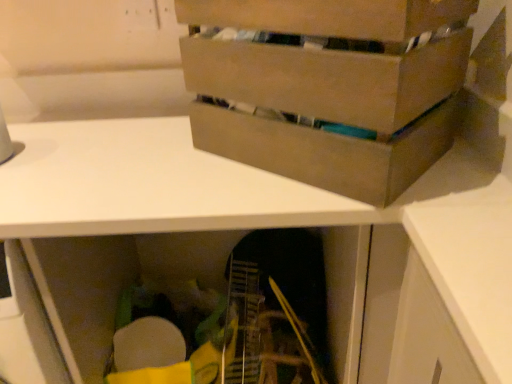
Identify the location of white matte desk at center. (251, 210).

Describe the element at coordinates (251, 210) in the screenshot. The image size is (512, 384). I see `white matte desk at center` at that location.

Describe the element at coordinates (328, 79) in the screenshot. I see `brown cardboard box at upper center` at that location.

Where is `brown cardboard box at upper center`? The image size is (512, 384). brown cardboard box at upper center is located at coordinates (328, 79).

This screenshot has height=384, width=512. Identify the location of white matte desk at center. (251, 210).

Is brown cardboard box at upper center to the left or to the right of white matte desk at center in the image?

From the image, it's evident that brown cardboard box at upper center is to the right of white matte desk at center.

Between brown cardboard box at upper center and white matte desk at center, which one is positioned in front?

brown cardboard box at upper center is closer to the camera.

Between point (429, 96) and point (236, 202), which one is positioned in front?

Point (429, 96)

From the image's perspective, which is below, brown cardboard box at upper center or white matte desk at center?

white matte desk at center is shown below in the image.

From the picture: From a real-world perspective, does brown cardboard box at upper center stand above white matte desk at center?

Yes.

Which object is thinner, brown cardboard box at upper center or white matte desk at center?

brown cardboard box at upper center is thinner.

Does brown cardboard box at upper center have a lesser height compared to white matte desk at center?

Correct, brown cardboard box at upper center is not as tall as white matte desk at center.

Is brown cardboard box at upper center bigger or smaller than white matte desk at center?

Clearly, brown cardboard box at upper center is smaller in size than white matte desk at center.

Which is correct: brown cardboard box at upper center is inside white matte desk at center, or outside of it?

brown cardboard box at upper center lies outside white matte desk at center.

Does brown cardboard box at upper center touch white matte desk at center?

There is a gap between brown cardboard box at upper center and white matte desk at center.

Based on the photo, is brown cardboard box at upper center facing away from white matte desk at center?

brown cardboard box at upper center does not have its back to white matte desk at center.

What's the angular difference between brown cardboard box at upper center and white matte desk at center's facing directions?

40.6 degrees.

Image resolution: width=512 pixels, height=384 pixels. Identify the location of desk that appears below the brown cardboard box at upper center (from the image's perspective). (251, 210).

Is white matte desk at center at the right side of brown cardboard box at upper center?

No, white matte desk at center is not to the right of brown cardboard box at upper center.

Is white matte desk at center in front of brown cardboard box at upper center?

No, white matte desk at center is behind brown cardboard box at upper center.

Is point (493, 179) closer or farther from the camera than point (334, 90)?

Point (493, 179).

From the image's perspective, is white matte desk at center below brown cardboard box at upper center?

Indeed, from the image's perspective, white matte desk at center is shown beneath brown cardboard box at upper center.

From a real-world perspective, is white matte desk at center positioned above or below brown cardboard box at upper center?

From a real-world perspective, white matte desk at center is physically below brown cardboard box at upper center.

Considering the relative sizes of white matte desk at center and brown cardboard box at upper center in the image provided, is white matte desk at center wider than brown cardboard box at upper center?

Indeed, white matte desk at center has a greater width compared to brown cardboard box at upper center.

Is white matte desk at center taller than brown cardboard box at upper center?

Indeed, white matte desk at center has a greater height compared to brown cardboard box at upper center.

Considering the relative sizes of white matte desk at center and brown cardboard box at upper center in the image provided, is white matte desk at center bigger than brown cardboard box at upper center?

Correct, white matte desk at center is larger in size than brown cardboard box at upper center.

Is white matte desk at center outside of brown cardboard box at upper center?

Yes, white matte desk at center is located beyond the bounds of brown cardboard box at upper center.

Is white matte desk at center next to brown cardboard box at upper center?

white matte desk at center and brown cardboard box at upper center are clearly separated.

Is white matte desk at center oriented towards brown cardboard box at upper center?

No, white matte desk at center is not oriented towards brown cardboard box at upper center.

In the scene shown: How many degrees apart are the facing directions of white matte desk at center and brown cardboard box at upper center?

40.6 degrees.

Where is `box above the white matte desk at center (from the image's perspective)`? box above the white matte desk at center (from the image's perspective) is located at coordinates (328, 79).

I want to click on desk located on the left of brown cardboard box at upper center, so (251, 210).

Image resolution: width=512 pixels, height=384 pixels. In order to click on desk directly beneath the brown cardboard box at upper center (from a real-world perspective) in this screenshot , I will do `click(251, 210)`.